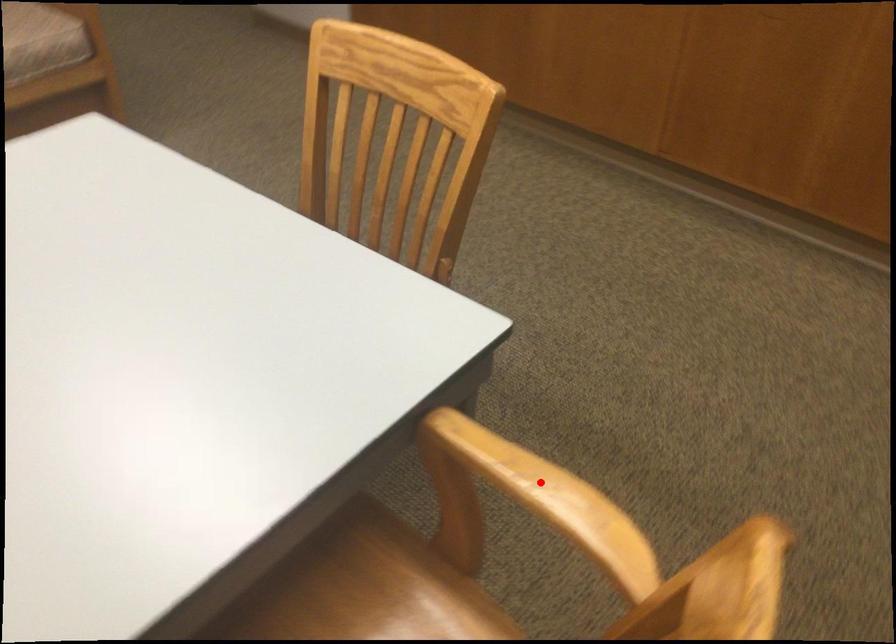
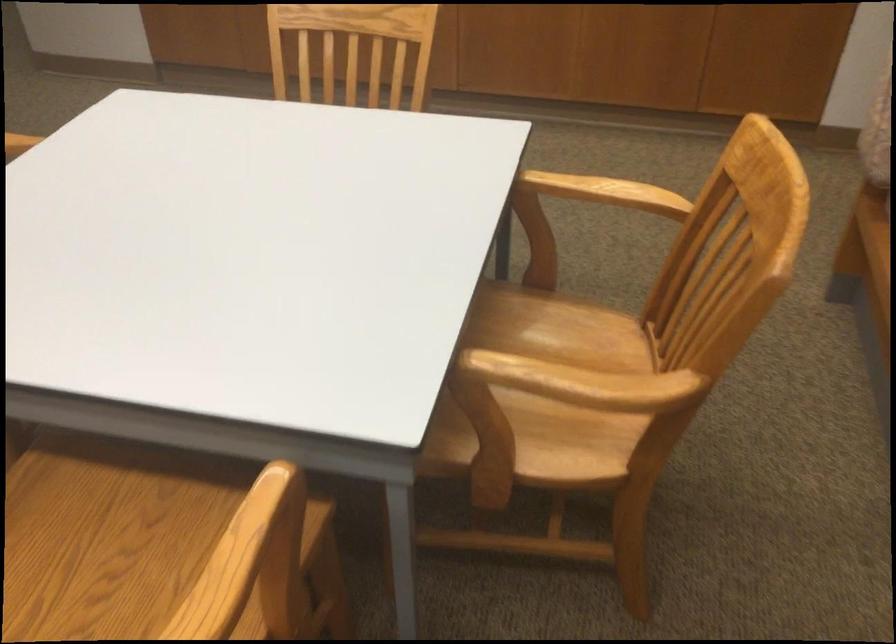
Question: I am providing you with two images of the same scene from different viewpoints. In image1, a red point is highlighted. Considering the same 3D point in image2, which of the following is correct?

Choices:
 (A) It is closer
 (B) It is farther

Answer: (B)